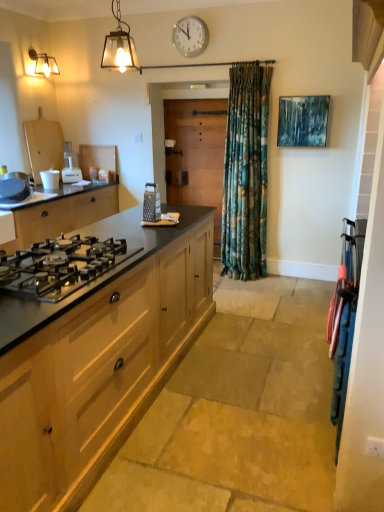
You are a GUI agent. You are given a task and a screenshot of the screen. Output one action in this format:
    pyautogui.click(x=<x>, y=<y>)
    Task: Click on the vacant area on top of wooden screen door at center (from a real-world perspective)
    This screenshot has height=512, width=384.
    Given the screenshot: What is the action you would take?
    pyautogui.click(x=193, y=100)